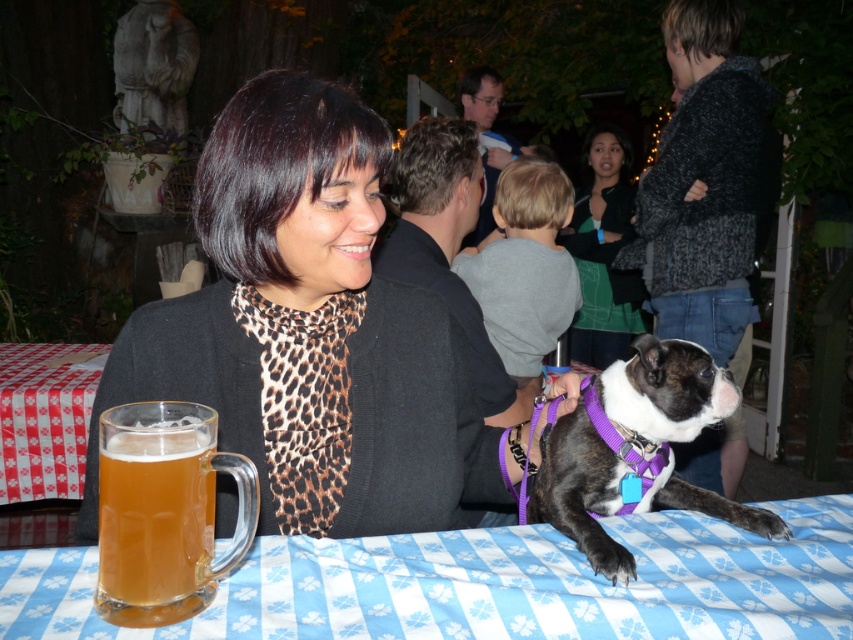
You are a guest at the gathering and want to grab a drink from the table. There is a translucent glass mug at lower left and a red checkered fabric at lower left. Which object should you reach for first if you want to pick up the mug?

You should reach for the translucent glass mug at lower left first because it is in front of the red checkered fabric at lower left, making it more accessible.

You are a guest at this event and want to place your phone on the table. The translucent glass mug at lower left and the red checkered fabric at lower left are both on the table. Which item has a larger surface area to place your phone?

The red checkered fabric at lower left has a larger surface area compared to the translucent glass mug at lower left, so it would be a better option for placing your phone.